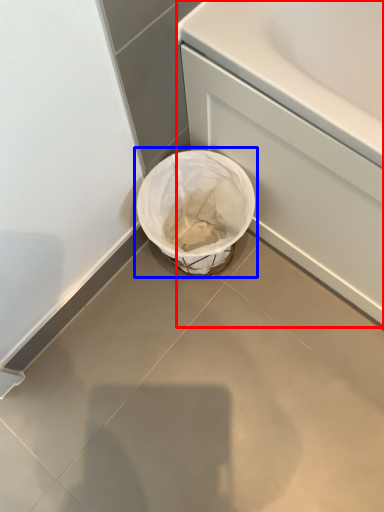
Question: Which object appears closest to the camera in this image, bath (highlighted by a red box) or waste container (highlighted by a blue box)?

Choices:
 (A) bath
 (B) waste container

Answer: (A)